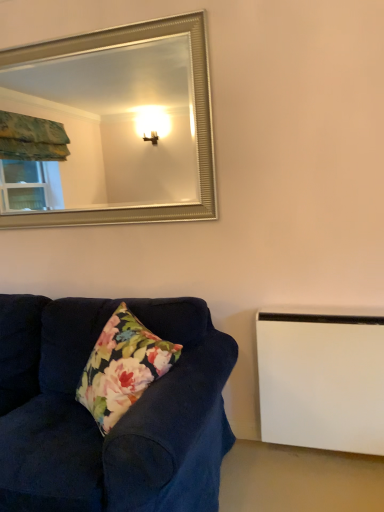
Question: In the image, is velvet dark blue couch at lower left on the left side or the right side of white matte radiator at lower right?

Choices:
 (A) left
 (B) right

Answer: (A)

Question: Is velvet dark blue couch at lower left wider or thinner than white matte radiator at lower right?

Choices:
 (A) thin
 (B) wide

Answer: (B)

Question: Which object is the closest to the silver metallic mirror at upper center?

Choices:
 (A) white matte radiator at lower right
 (B) velvet dark blue couch at lower left

Answer: (B)

Question: Which object is the closest to the velvet dark blue couch at lower left?

Choices:
 (A) white matte radiator at lower right
 (B) silver metallic mirror at upper center

Answer: (A)